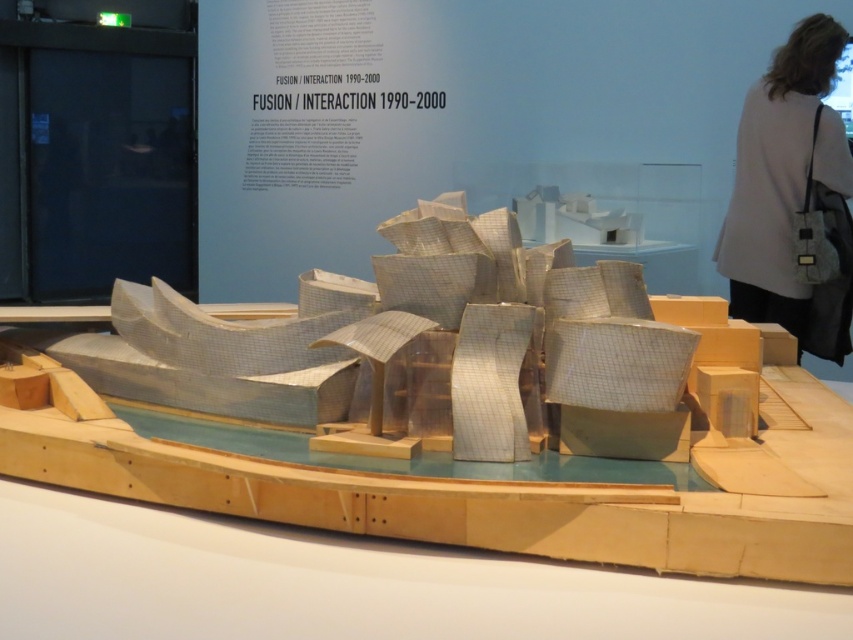
Question: Which object is farther from the camera taking this photo?

Choices:
 (A) white fabric bag at upper right
 (B) metallic grid boat at center

Answer: (A)

Question: Which point is farther to the camera?

Choices:
 (A) white fabric bag at upper right
 (B) metallic grid boat at center

Answer: (A)

Question: Is metallic grid boat at center to the right of white fabric bag at upper right from the viewer's perspective?

Choices:
 (A) yes
 (B) no

Answer: (B)

Question: Can you confirm if metallic grid boat at center is positioned to the right of white fabric bag at upper right?

Choices:
 (A) yes
 (B) no

Answer: (B)

Question: Which object appears closest to the camera in this image?

Choices:
 (A) metallic grid boat at center
 (B) white fabric bag at upper right

Answer: (A)

Question: Considering the relative positions of metallic grid boat at center and white fabric bag at upper right in the image provided, where is metallic grid boat at center located with respect to white fabric bag at upper right?

Choices:
 (A) above
 (B) below

Answer: (B)